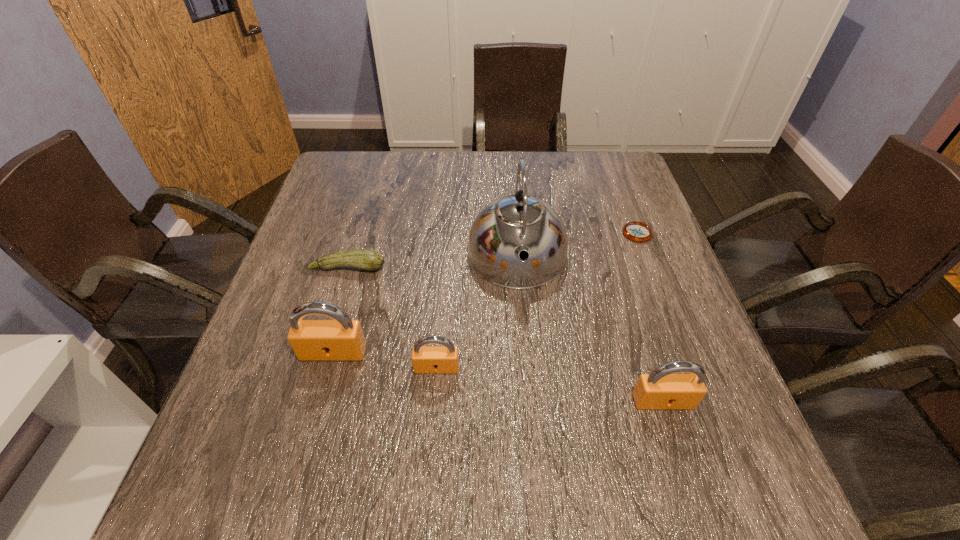
Image resolution: width=960 pixels, height=540 pixels. In order to click on empty location between the tallest object and the nearest padlock in this screenshot , I will do `click(590, 329)`.

Find the location of a particular element. This screenshot has height=540, width=960. vacant space that is in between the third object from right to left and the nearest object is located at coordinates (590, 329).

Locate an element on the screen. vacant area that lies between the second tallest padlock and the compass is located at coordinates (650, 317).

The width and height of the screenshot is (960, 540). Find the location of `vacant area that lies between the second tallest object and the second padlock from left to right`. vacant area that lies between the second tallest object and the second padlock from left to right is located at coordinates (385, 360).

Image resolution: width=960 pixels, height=540 pixels. Identify the location of vacant area that lies between the fourth tallest object and the kettle. (477, 312).

Identify the location of empty space that is in between the fourth tallest object and the compass. (537, 300).

Image resolution: width=960 pixels, height=540 pixels. In order to click on empty space between the shortest object and the shortest padlock in this screenshot , I will do `click(537, 300)`.

I want to click on object that stands as the closest to the rightmost padlock, so click(511, 226).

Locate an element on the screen. object that is the closest to the fifth tallest object is located at coordinates point(342,339).

This screenshot has width=960, height=540. Find the location of `padlock that is the closest one to the tallest object`. padlock that is the closest one to the tallest object is located at coordinates (444, 359).